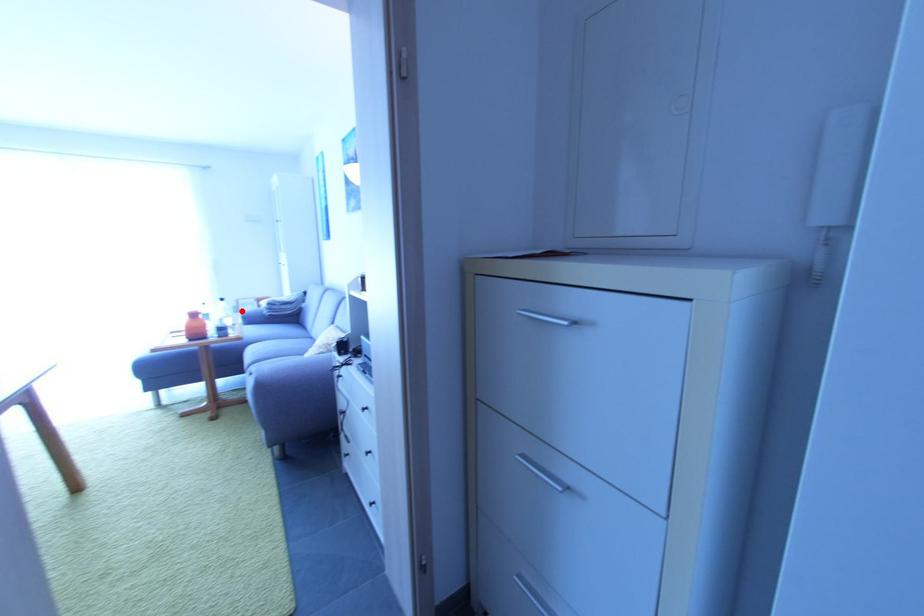
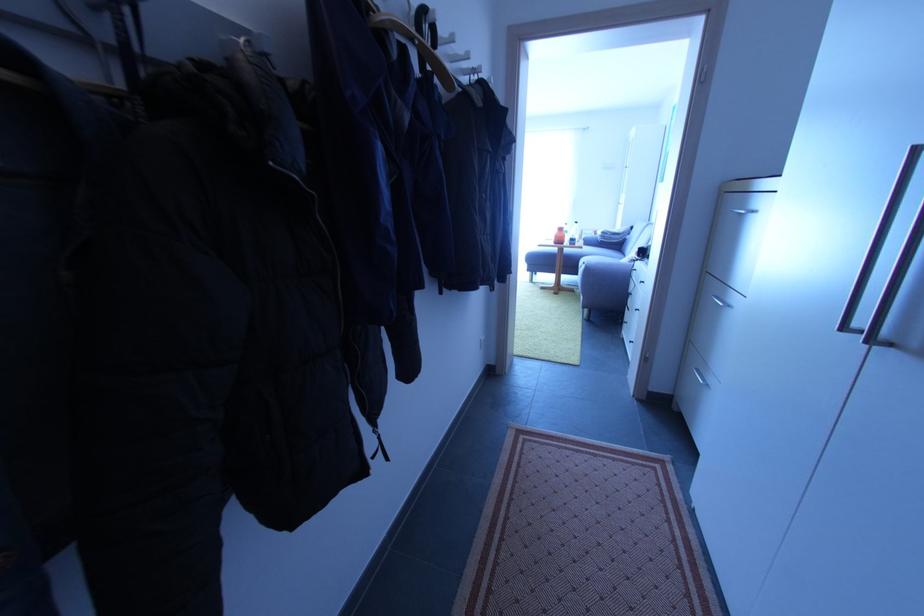
Find the pixel in the second image that matches the highlighted location in the first image.

(585, 238)